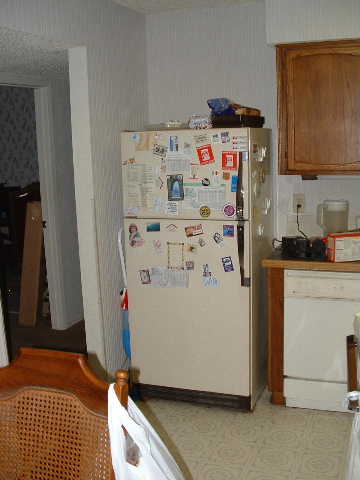
Find the location of `wooden diningroom chair`. wooden diningroom chair is located at coordinates (12, 205).